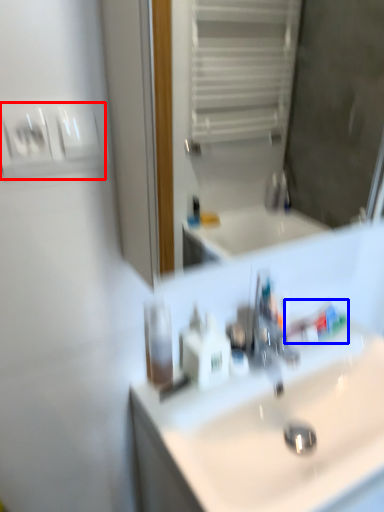
Question: Which object is closer to the camera taking this photo, light switch (highlighted by a red box) or toothpaste (highlighted by a blue box)?

Choices:
 (A) light switch
 (B) toothpaste

Answer: (A)